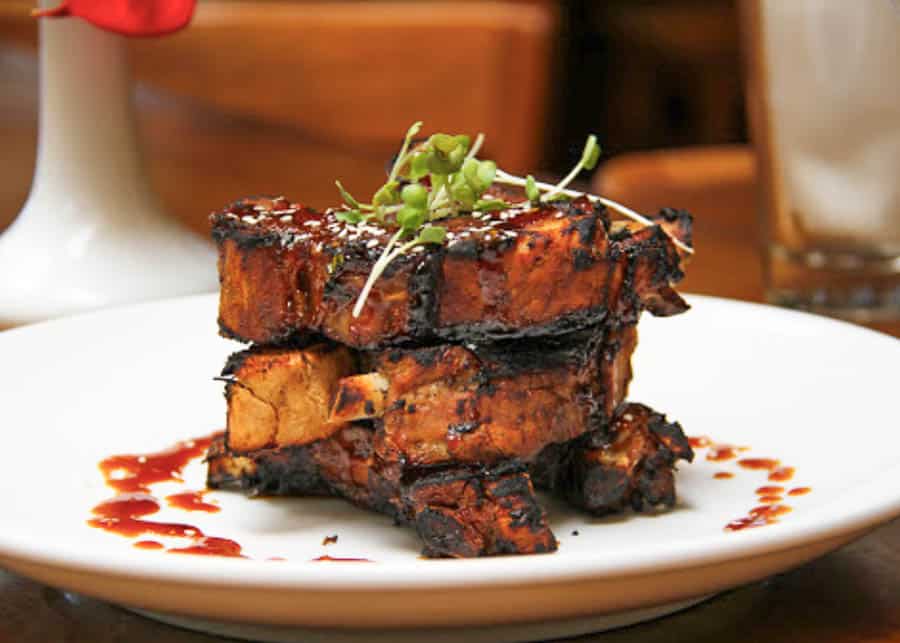
At what (x,y) coordinates should I click in order to perform the action: click on glass. Please return your answer as a coordinate pair (x, y). This screenshot has width=900, height=643. Looking at the image, I should click on (831, 95).